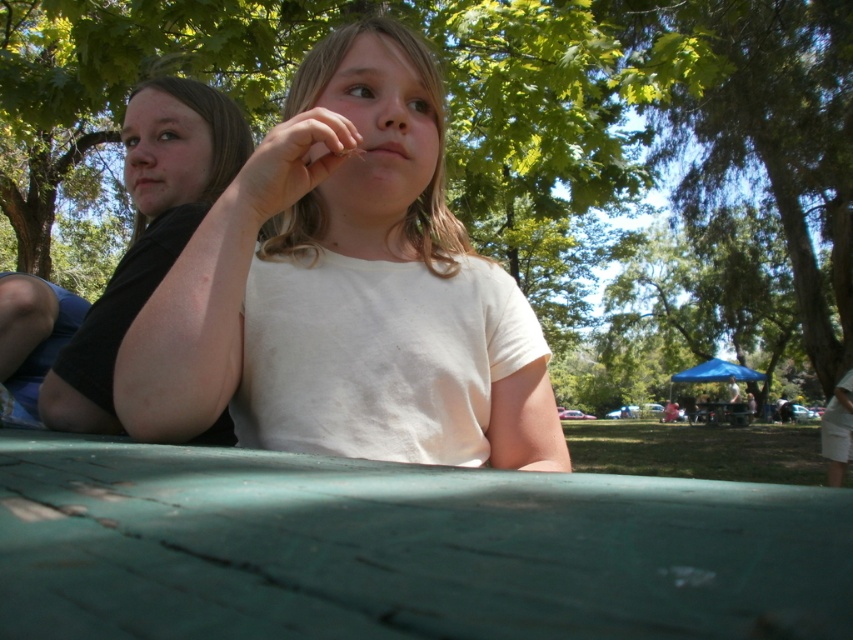
Describe the element at coordinates (345, 291) in the screenshot. This screenshot has height=640, width=853. I see `white matte shirt at center` at that location.

Which of these two, white matte shirt at center or black matte shirt at left, stands taller?

With more height is black matte shirt at left.

The width and height of the screenshot is (853, 640). Describe the element at coordinates (345, 291) in the screenshot. I see `white matte shirt at center` at that location.

I want to click on white matte shirt at center, so click(345, 291).

Is green leafy tree at center positioned before black matte shirt at left?

No, it is behind black matte shirt at left.

Identify the location of green leafy tree at center. This screenshot has width=853, height=640. (491, 112).

Where is `green leafy tree at center`? The height and width of the screenshot is (640, 853). green leafy tree at center is located at coordinates (491, 112).

Is white matte shirt at center closer to camera compared to smooth skin hand at center?

Yes, white matte shirt at center is closer to the viewer.

Locate an element on the screen. white matte shirt at center is located at coordinates (345, 291).